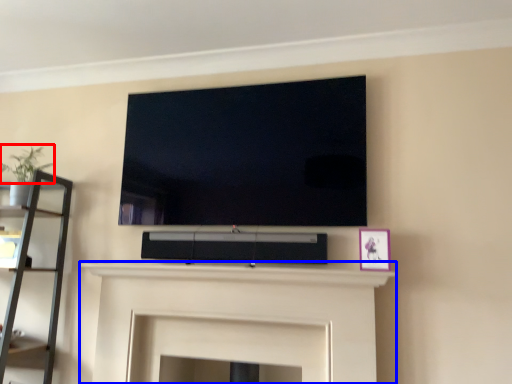
Question: Which object is further to the camera taking this photo, plant (highlighted by a red box) or fireplace (highlighted by a blue box)?

Choices:
 (A) plant
 (B) fireplace

Answer: (A)